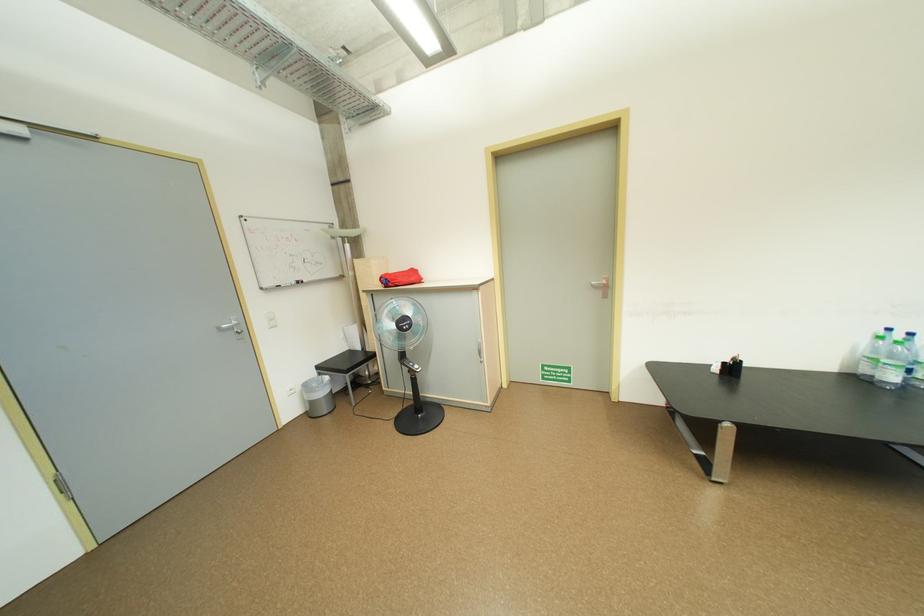
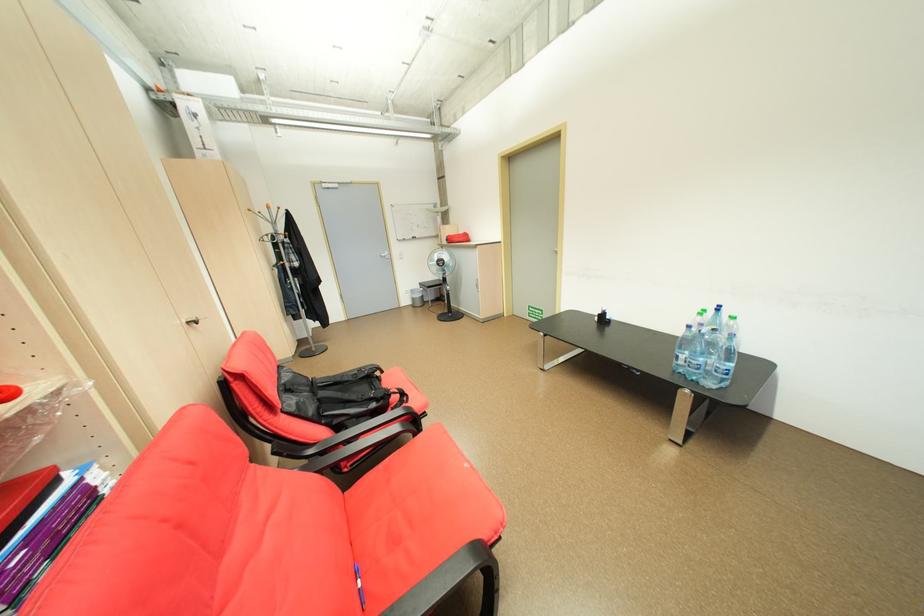
Find the pixel in the second image that matches point (298, 411) in the first image.

(415, 302)